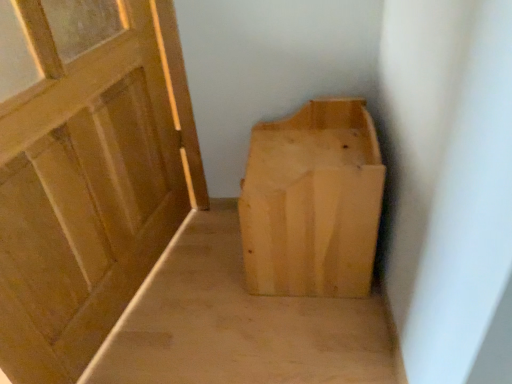
Where is `blank area to the left of light wood/rough textured box at center`? This screenshot has width=512, height=384. blank area to the left of light wood/rough textured box at center is located at coordinates (208, 272).